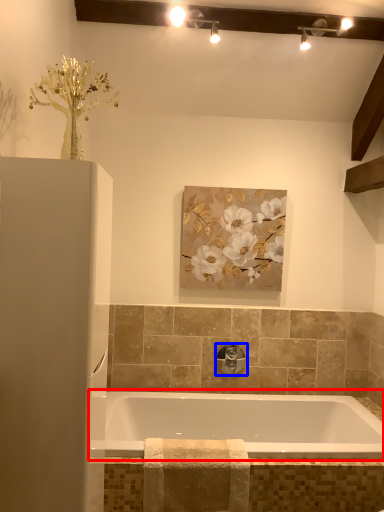
Question: Which of the following is the farthest to the observer, bathtub (highlighted by a red box) or tap (highlighted by a blue box)?

Choices:
 (A) bathtub
 (B) tap

Answer: (B)